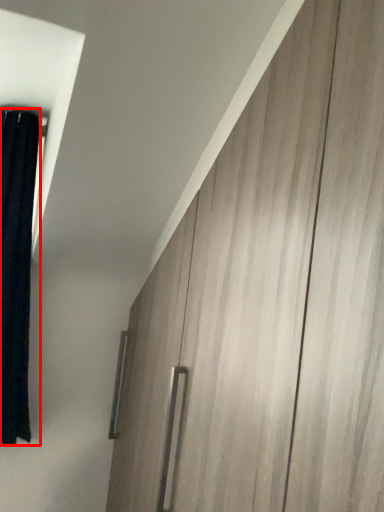
Question: From the image, what is the correct spatial relationship of curtain (annotated by the red box) in relation to barn door?

Choices:
 (A) left
 (B) right

Answer: (A)